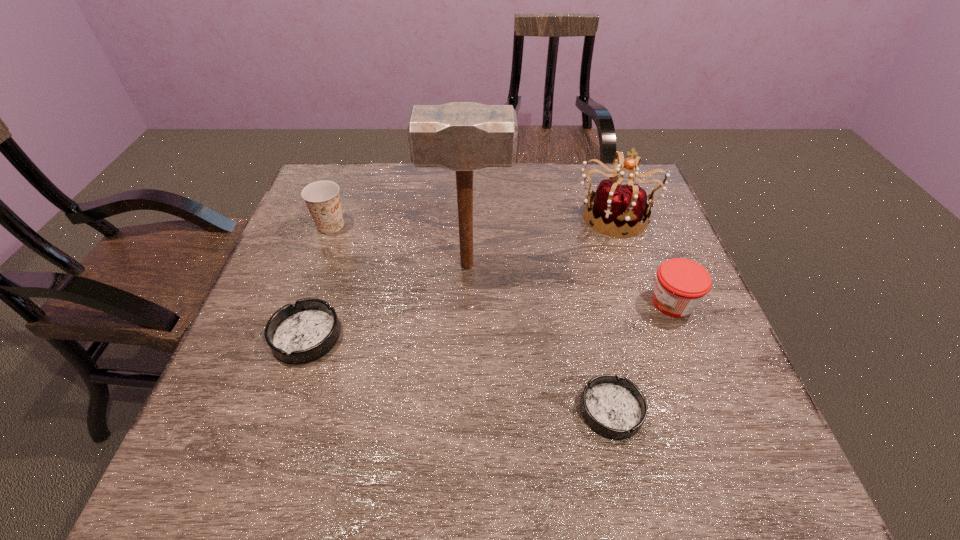
Choose which object is the second nearest neighbor to the second tallest object. Please provide its 2D coordinates. Your answer should be formatted as a tuple, i.e. [(x, y)], where the tuple contains the x and y coordinates of a point satisfying the conditions above.

[(463, 137)]

At what (x,y) coordinates should I click in order to perform the action: click on vacant region that satisfies the following two spatial constraints: 1. on the front side of the shortest object; 2. on the left side of the taller ashtray. Please return your answer as a coordinate pair (x, y). The height and width of the screenshot is (540, 960). Looking at the image, I should click on pyautogui.click(x=281, y=410).

The height and width of the screenshot is (540, 960). Identify the location of vacant space that satisfies the following two spatial constraints: 1. on the front side of the nearer ashtray; 2. on the left side of the second shortest object. (281, 410).